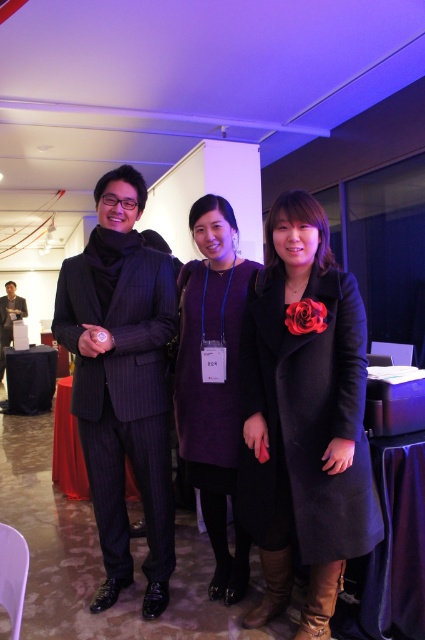
Question: Based on their relative distances, which object is nearer to the black wool coat at center?

Choices:
 (A) matte black suit at left
 (B) pinstriped wool suit at center
 (C) purple wool dress at center

Answer: (C)

Question: Does purple wool dress at center have a larger size compared to matte black suit at left?

Choices:
 (A) yes
 (B) no

Answer: (B)

Question: Which point is closer to the camera?

Choices:
 (A) pinstriped wool suit at center
 (B) purple wool dress at center

Answer: (A)

Question: Which is farther from the black wool coat at center?

Choices:
 (A) matte black suit at left
 (B) purple wool dress at center
 (C) pinstriped wool suit at center

Answer: (A)

Question: Does pinstriped wool suit at center have a greater width compared to matte black suit at left?

Choices:
 (A) no
 (B) yes

Answer: (B)

Question: Where is black wool coat at center located in relation to purple wool dress at center in the image?

Choices:
 (A) right
 (B) left

Answer: (A)